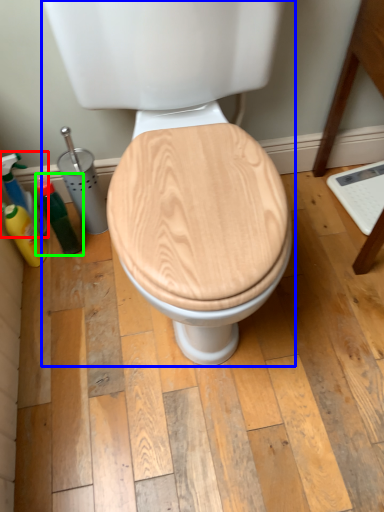
Question: Based on their relative distances, which object is nearer to cleaning product (highlighted by a red box)? Choose from toilet (highlighted by a blue box) and bottle (highlighted by a green box).

Choices:
 (A) toilet
 (B) bottle

Answer: (B)